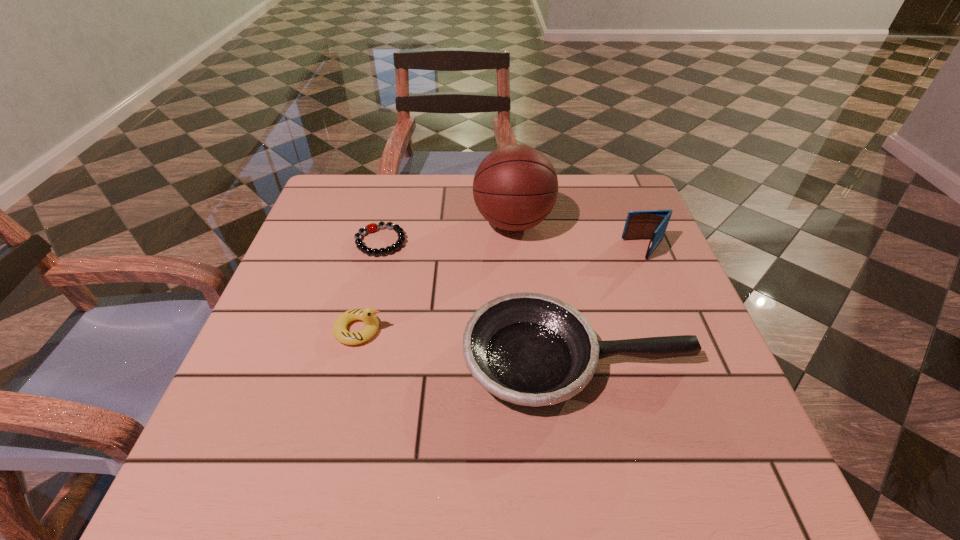
Image resolution: width=960 pixels, height=540 pixels. Identify the location of the tallest object. (515, 187).

Locate an element on the screen. the second tallest object is located at coordinates (652, 224).

You are a GUI agent. You are given a task and a screenshot of the screen. Output one action in this format:
    pyautogui.click(x=<x>, y=<y>)
    Task: Click on the duckling
    Image resolution: width=960 pixels, height=540 pixels.
    Given the screenshot: What is the action you would take?
    point(367,315)

Identify the location of frying pan. The width and height of the screenshot is (960, 540). (531, 349).

You are a GUI agent. You are given a task and a screenshot of the screen. Output one action in this format:
    pyautogui.click(x=<x>, y=<y>)
    Task: Click on the bracelet
    
    Given the screenshot: What is the action you would take?
    pyautogui.click(x=372, y=227)

What are the coordinates of `vacant space situated 0.080m on the left of the tallest object` in the screenshot? It's located at (441, 222).

Where is `vacant position located 0.090m on the exterior surface of the second tallest object`? vacant position located 0.090m on the exterior surface of the second tallest object is located at coordinates tap(587, 249).

I want to click on free spot located on the exterior surface of the second tallest object, so click(521, 249).

Where is `vacant space situated on the exterior surface of the second tallest object`? vacant space situated on the exterior surface of the second tallest object is located at coordinates (513, 249).

Locate an element on the screen. free space located 0.270m on the face of the duckling is located at coordinates (523, 329).